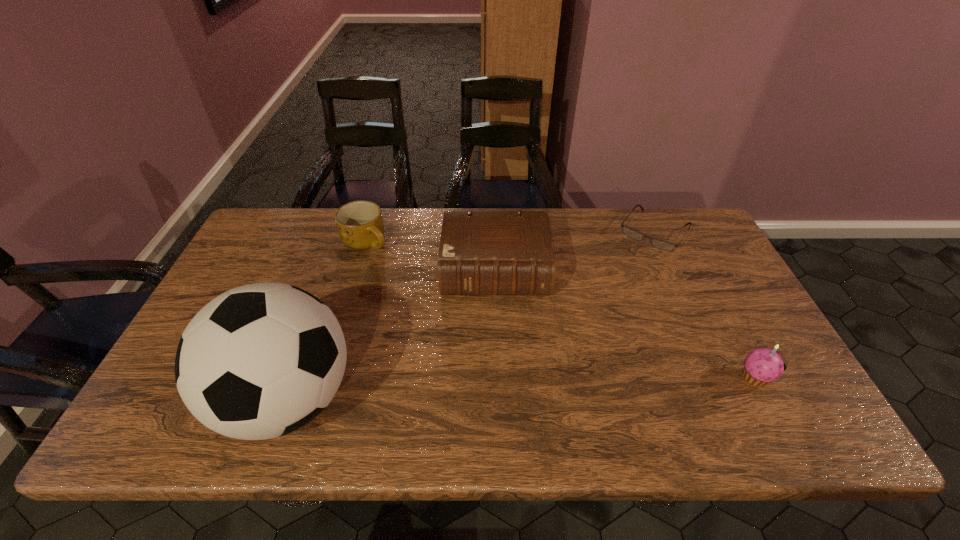
This screenshot has height=540, width=960. Identify the location of soccer ball. [x=259, y=361].

Locate an element on the screen. cupcake is located at coordinates (762, 365).

Find the location of a particular element. The image size is (960, 540). spectacles is located at coordinates (659, 244).

Locate an element on the screen. the second shortest object is located at coordinates (360, 225).

Identify the location of the third object from right to left. (484, 253).

Where is `free space located 0.360m on the back of the tallest object`? The height and width of the screenshot is (540, 960). free space located 0.360m on the back of the tallest object is located at coordinates (340, 252).

Find the location of a particular element. This screenshot has width=960, height=540. vacant space situated 0.330m on the front-facing side of the spectacles is located at coordinates (595, 316).

Identify the location of vacant space located on the front-facing side of the spectacles. (607, 301).

You are a GUI agent. You are given a task and a screenshot of the screen. Output one action in this format:
    pyautogui.click(x=<x>, y=<y>)
    Task: Click on the vacant space located on the front-facing side of the spectacles
    Image resolution: width=960 pixels, height=540 pixels.
    Given the screenshot: What is the action you would take?
    pyautogui.click(x=630, y=267)

At what (x,y) coordinates should I click in order to perform the action: click on blank area located on the side with the handle of the fourth tallest object. Please return your answer as a coordinate pair (x, y). Image resolution: width=960 pixels, height=540 pixels. Looking at the image, I should click on (418, 311).